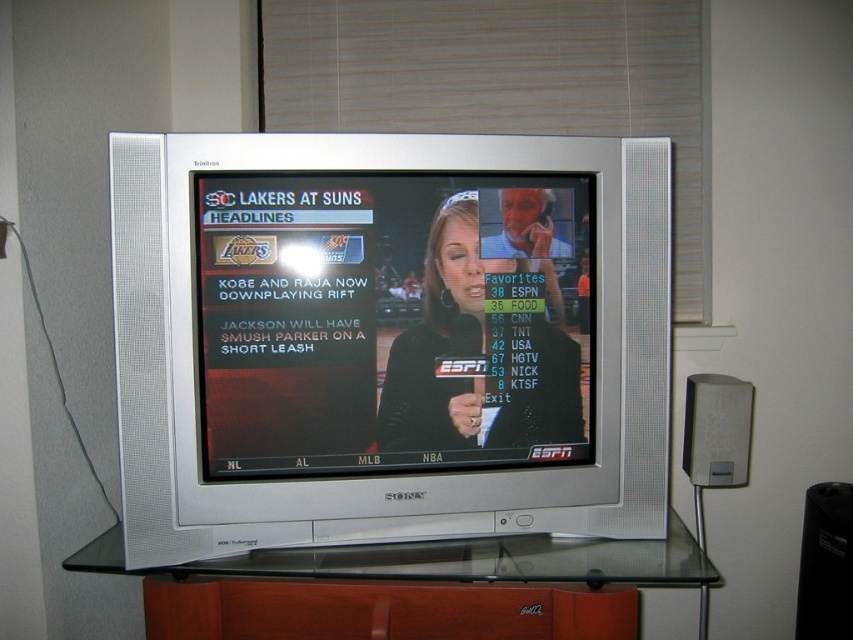
Between point (448, 412) and point (280, 566), which one is positioned behind?

The point (448, 412) is more distant.

The height and width of the screenshot is (640, 853). What do you see at coordinates (480, 352) in the screenshot?
I see `black fabric at center` at bounding box center [480, 352].

Which is in front, point (399, 394) or point (654, 573)?

Point (654, 573) is more forward.

Where is `black fabric at center`? black fabric at center is located at coordinates (480, 352).

Who is shorter, matte black tv screen at center or satin silver speaker at right?

satin silver speaker at right

Is point (207, 195) positioned in front of point (746, 392)?

Yes, it is in front of point (746, 392).

The height and width of the screenshot is (640, 853). What are the coordinates of `matte black tv screen at center` in the screenshot? It's located at (387, 321).

Which of these two, matte black tv screen at center or white textured blinds at upper center, stands shorter?

With less height is matte black tv screen at center.

Who is positioned more to the left, matte black tv screen at center or white textured blinds at upper center?

matte black tv screen at center

You are a GUI agent. You are given a task and a screenshot of the screen. Output one action in this format:
    pyautogui.click(x=<x>, y=<y>)
    Task: Click on the matte black tv screen at center
    The width and height of the screenshot is (853, 640).
    Given the screenshot: What is the action you would take?
    pyautogui.click(x=387, y=321)